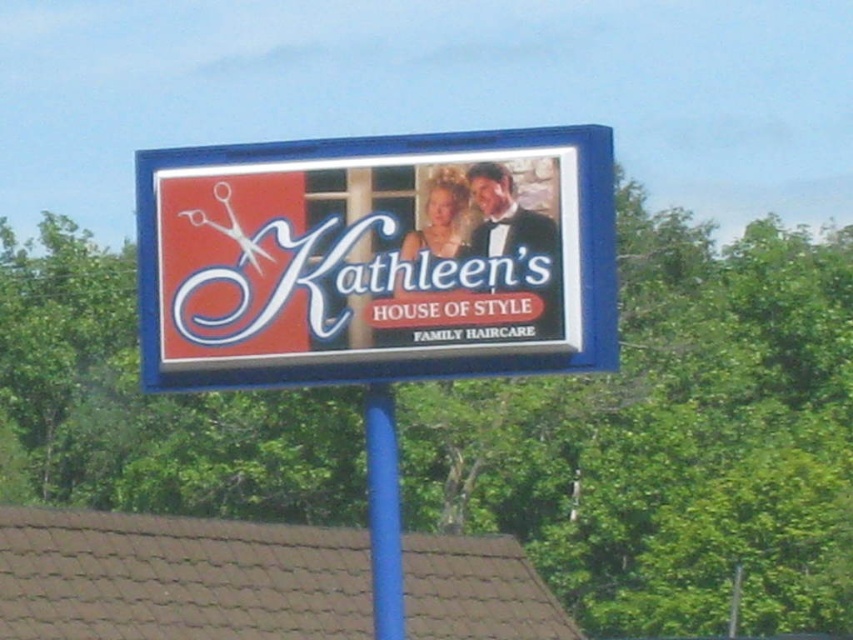
Between matte plastic sign at center and matte white signboard at center, which one appears on the left side from the viewer's perspective?

From the viewer's perspective, matte plastic sign at center appears more on the left side.

Between point (372, 349) and point (209, 250), which one is positioned behind?

The point (209, 250) is behind.

This screenshot has width=853, height=640. I want to click on matte plastic sign at center, so click(373, 259).

Describe the element at coordinates (373, 259) in the screenshot. I see `matte plastic sign at center` at that location.

Between point (277, 246) and point (380, 634), which one is positioned behind?

Point (277, 246)

Is point (381, 364) farther from viewer compared to point (393, 440)?

That is False.

Where is `matte plastic sign at center`? This screenshot has height=640, width=853. matte plastic sign at center is located at coordinates (373, 259).

Can you confirm if matte white signboard at center is taller than blue plastic pole at center?

Incorrect, matte white signboard at center's height is not larger of blue plastic pole at center's.

Between matte white signboard at center and blue plastic pole at center, which one has less height?

With less height is matte white signboard at center.

Does point (486, 236) come in front of point (387, 529)?

Yes, point (486, 236) is closer to viewer.

This screenshot has height=640, width=853. Identify the location of matte white signboard at center. (369, 259).